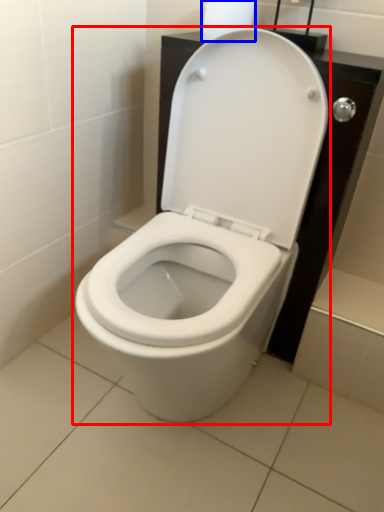
Question: Which point is closer to the camera, toilet (highlighted by a red box) or toilet paper (highlighted by a blue box)?

Choices:
 (A) toilet
 (B) toilet paper

Answer: (A)